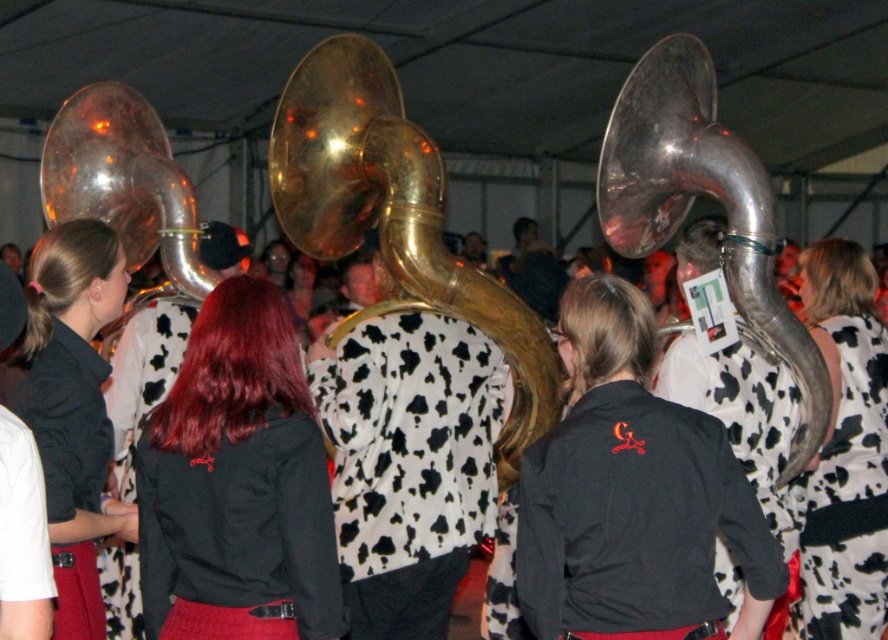
Is cow print shirt at center below matte black shirt at center?

Yes.

Can you confirm if cow print shirt at center is bigger than matte black shirt at center?

Yes.

What do you see at coordinates (409, 465) in the screenshot? I see `cow print shirt at center` at bounding box center [409, 465].

I want to click on cow print shirt at center, so (x=409, y=465).

Can you confirm if gold shiny tuba at center is shorter than shiny brass tuba at left?

In fact, gold shiny tuba at center may be taller than shiny brass tuba at left.

Does gold shiny tuba at center have a lesser width compared to shiny brass tuba at left?

No.

Between point (488, 291) and point (112, 212), which one is positioned in front?

Positioned in front is point (488, 291).

Locate an element on the screen. The width and height of the screenshot is (888, 640). gold shiny tuba at center is located at coordinates [395, 216].

Is black fabric shirt at center below matte black shirt at center?

Correct, black fabric shirt at center is located below matte black shirt at center.

Is point (195, 330) in front of point (81, 577)?

No, (195, 330) is behind (81, 577).

Find the location of a particular element. black fabric shirt at center is located at coordinates (236, 480).